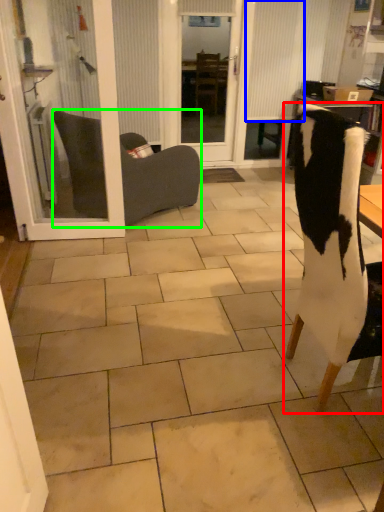
Question: Which is farther away from chair (highlighted by a red box)? curtain (highlighted by a blue box) or chair (highlighted by a green box)?

Choices:
 (A) curtain
 (B) chair

Answer: (A)